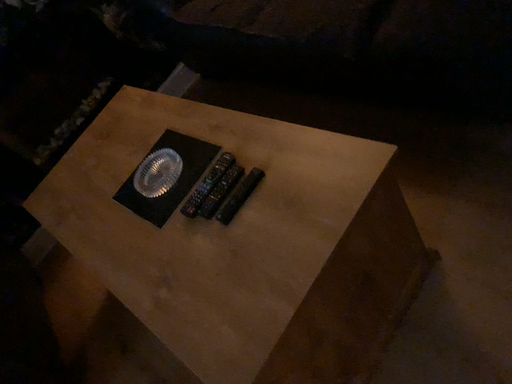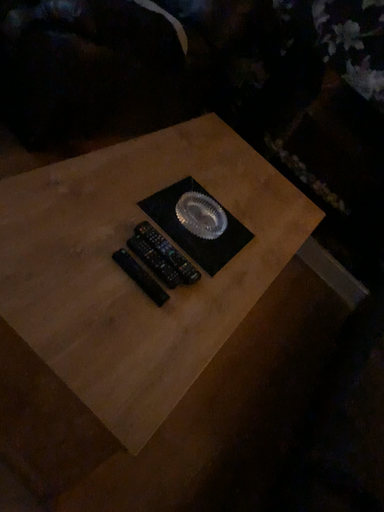
Question: Which way did the camera rotate in the video?

Choices:
 (A) rotated left
 (B) rotated right

Answer: (A)